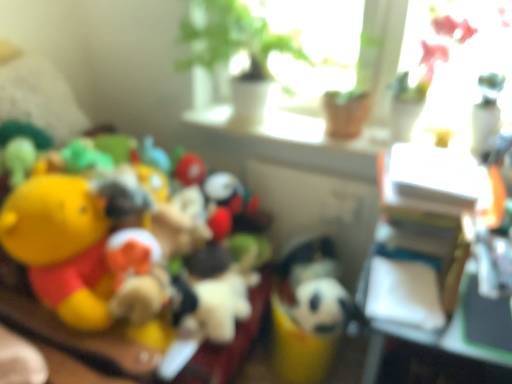
Question: From the image's perspective, is white plush toy at center, which is the 2th toy in left-to-right order, below yellow plush toy at left, the 2th toy positioned from the right?

Choices:
 (A) no
 (B) yes

Answer: (B)

Question: From the image's perspective, is white plush toy at center, which is the 2th toy in left-to-right order, over yellow plush toy at left, the 2th toy positioned from the right?

Choices:
 (A) yes
 (B) no

Answer: (B)

Question: Does white plush toy at center, which is the 1th toy from right to left, have a lesser width compared to yellow plush toy at left, the 1th toy in the left-to-right sequence?

Choices:
 (A) no
 (B) yes

Answer: (B)

Question: Is the depth of white plush toy at center, which is the 1th toy from right to left, greater than that of yellow plush toy at left, the 1th toy in the left-to-right sequence?

Choices:
 (A) yes
 (B) no

Answer: (A)

Question: Is white plush toy at center, which is the 2th toy in left-to-right order, outside of yellow plush toy at left, the 1th toy in the left-to-right sequence?

Choices:
 (A) no
 (B) yes

Answer: (B)

Question: In terms of height, does black plush toy at center look taller or shorter compared to yellow plush toy at left, the 1th toy in the left-to-right sequence?

Choices:
 (A) tall
 (B) short

Answer: (B)

Question: Does point (318, 284) appear closer or farther from the camera than point (175, 248)?

Choices:
 (A) farther
 (B) closer

Answer: (A)

Question: Relative to yellow plush toy at left, the 2th toy positioned from the right, is black plush toy at center in front or behind?

Choices:
 (A) behind
 (B) front

Answer: (A)

Question: Is black plush toy at center bigger or smaller than yellow plush toy at left, the 1th toy in the left-to-right sequence?

Choices:
 (A) big
 (B) small

Answer: (B)

Question: Relative to white plush toy at center, which is the 2th toy in left-to-right order, is black plush toy at center in front or behind?

Choices:
 (A) behind
 (B) front

Answer: (B)

Question: Considering the positions of black plush toy at center and white plush toy at center, which is the 1th toy from right to left, in the image, is black plush toy at center wider or thinner than white plush toy at center, which is the 1th toy from right to left,?

Choices:
 (A) thin
 (B) wide

Answer: (A)

Question: From the image's perspective, is black plush toy at center positioned above or below white plush toy at center, which is the 1th toy from right to left?

Choices:
 (A) below
 (B) above

Answer: (B)

Question: Considering the positions of black plush toy at center and white plush toy at center, which is the 1th toy from right to left, in the image, is black plush toy at center taller or shorter than white plush toy at center, which is the 1th toy from right to left,?

Choices:
 (A) short
 (B) tall

Answer: (A)

Question: From the image's perspective, is yellow plush toy at left, the 1th toy in the left-to-right sequence, located above or below black plush toy at center?

Choices:
 (A) above
 (B) below

Answer: (A)

Question: In the image, is yellow plush toy at left, the 2th toy positioned from the right, positioned in front of or behind black plush toy at center?

Choices:
 (A) behind
 (B) front

Answer: (B)